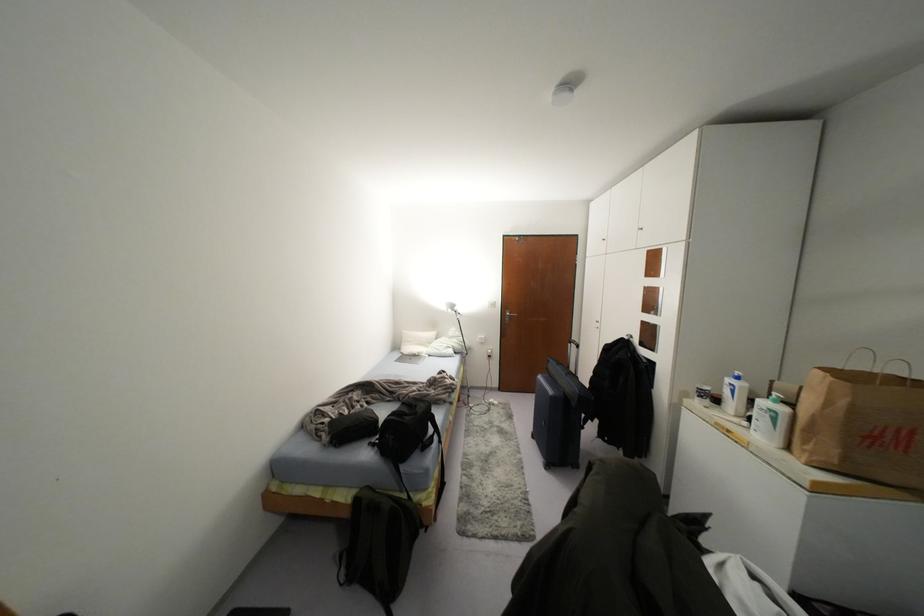
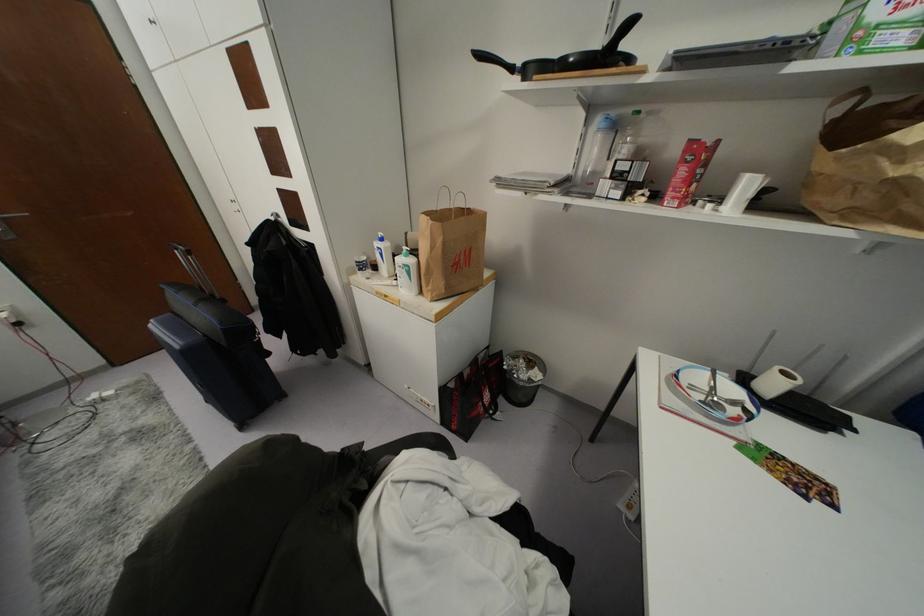
Where in the second image is the point corresponding to point (733, 391) from the first image?

(381, 254)